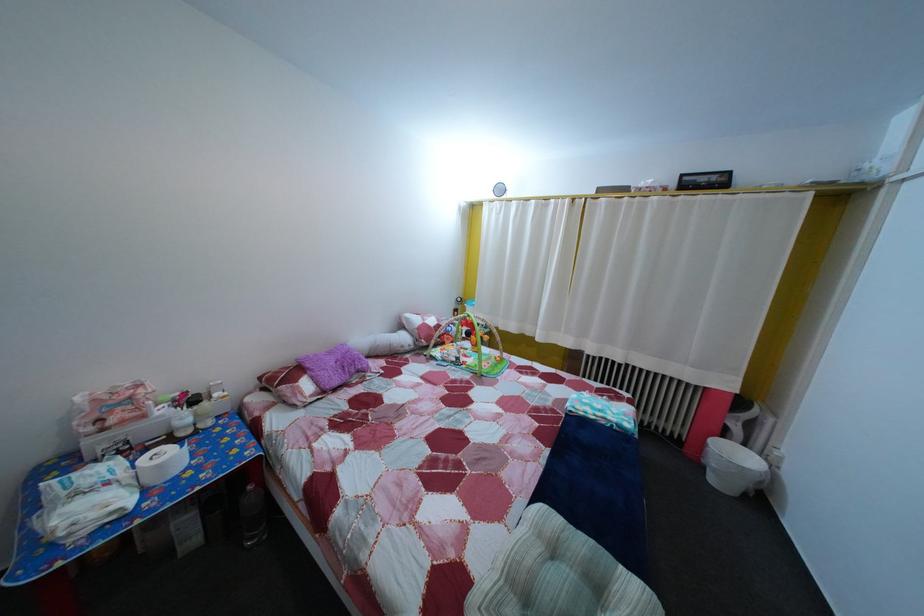
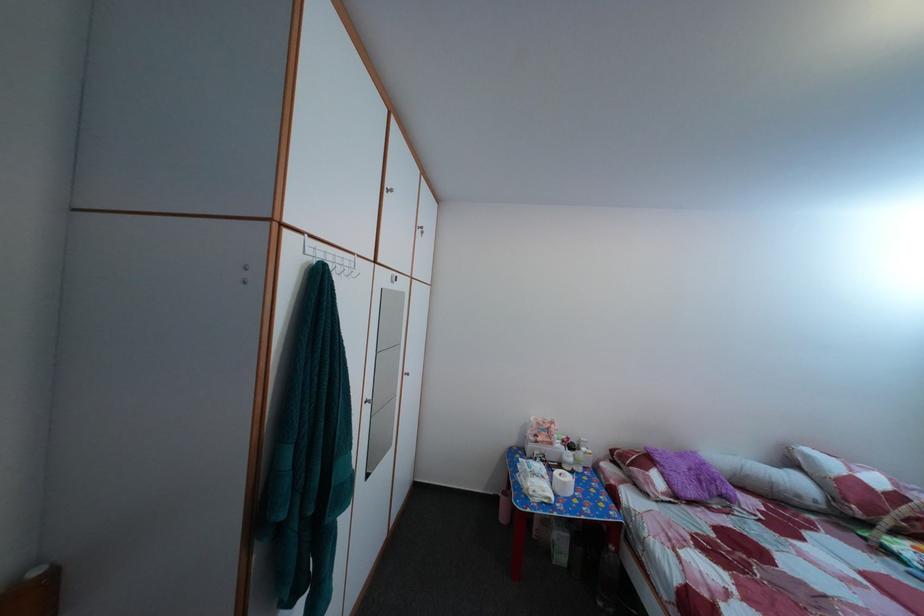
Find the pixel in the second image that matches point 339,361 in the first image.

(689, 464)